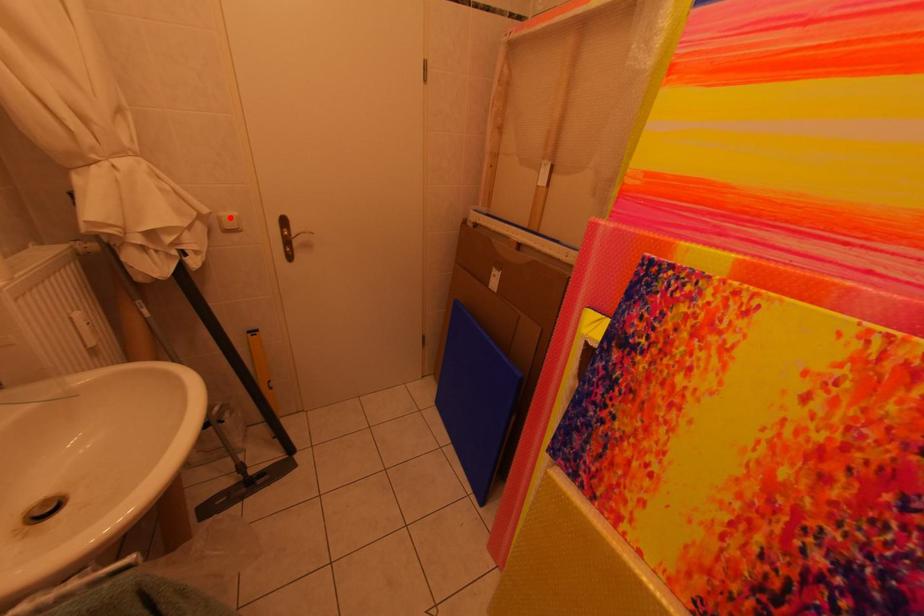
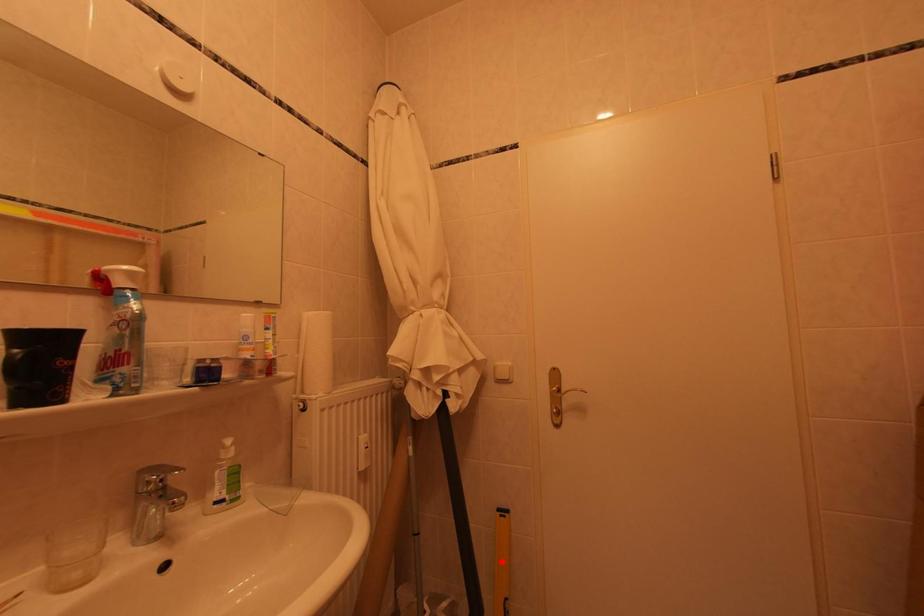
I am providing you with two images of the same scene from different viewpoints. A red point is marked on the first image and another point is marked on the second image. Does the point marked in image1 correspond to the same location as the one in image2?

No